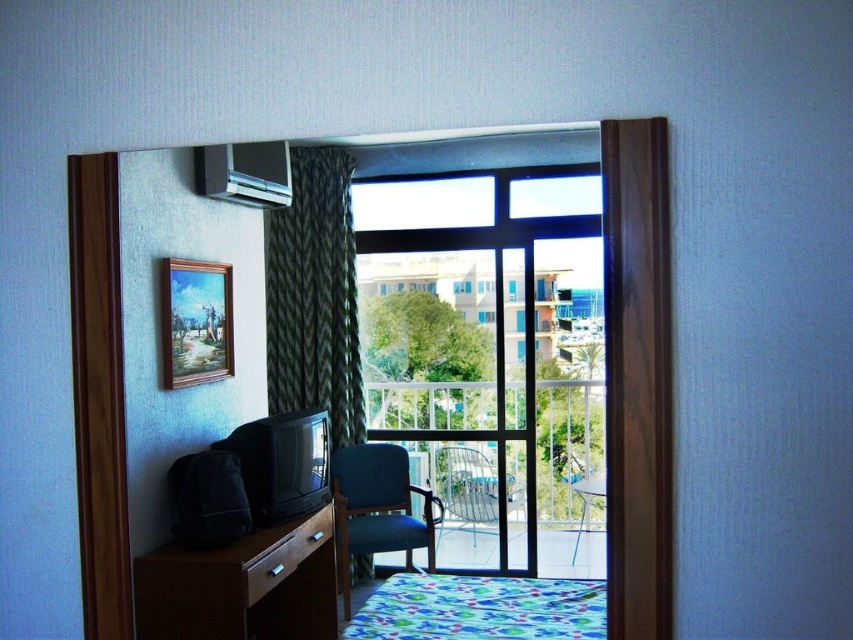
Can you confirm if brown wood table at lower left is positioned to the left of transparent glass window at center?

Yes, brown wood table at lower left is to the left of transparent glass window at center.

Describe the element at coordinates (242, 586) in the screenshot. The width and height of the screenshot is (853, 640). I see `brown wood table at lower left` at that location.

At what (x,y) coordinates should I click in order to perform the action: click on brown wood table at lower left. Please return your answer as a coordinate pair (x, y). This screenshot has width=853, height=640. Looking at the image, I should click on (242, 586).

Is transparent glass terrace at center smaller than brown wood table at lower left?

Indeed, transparent glass terrace at center has a smaller size compared to brown wood table at lower left.

Measure the distance from transparent glass terrace at center to brown wood table at lower left.

4.47 feet

Is point (613, 387) more distant than point (321, 545)?

No.

Image resolution: width=853 pixels, height=640 pixels. I want to click on transparent glass terrace at center, so click(637, 378).

Measure the distance from brown wood table at lower left to metallic silver table at center.

They are 2.03 meters apart.

Is brown wood table at lower left behind metallic silver table at center?

No, it is not.

Which is in front, point (300, 568) or point (587, 476)?

Point (300, 568) is in front.

Locate an element on the screen. The width and height of the screenshot is (853, 640). brown wood table at lower left is located at coordinates (242, 586).